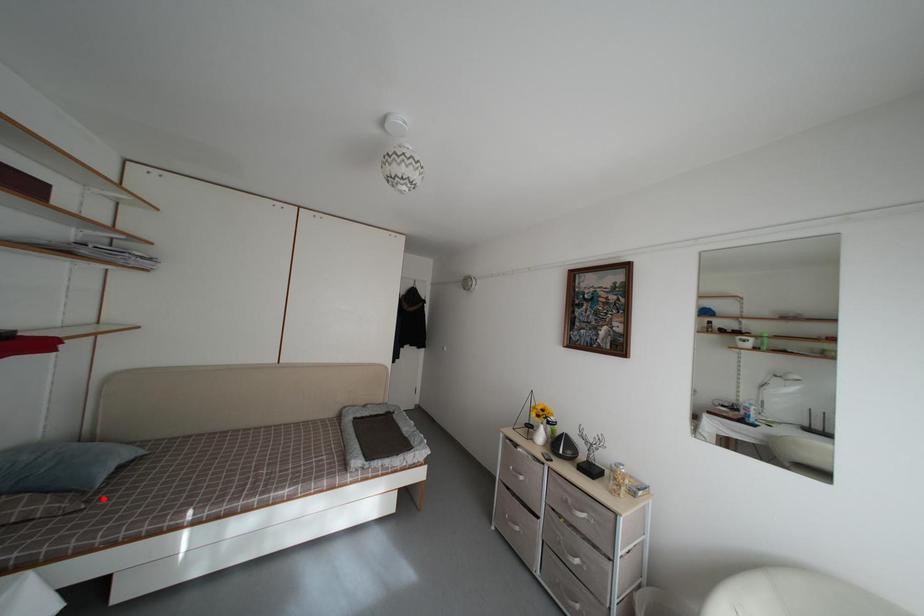
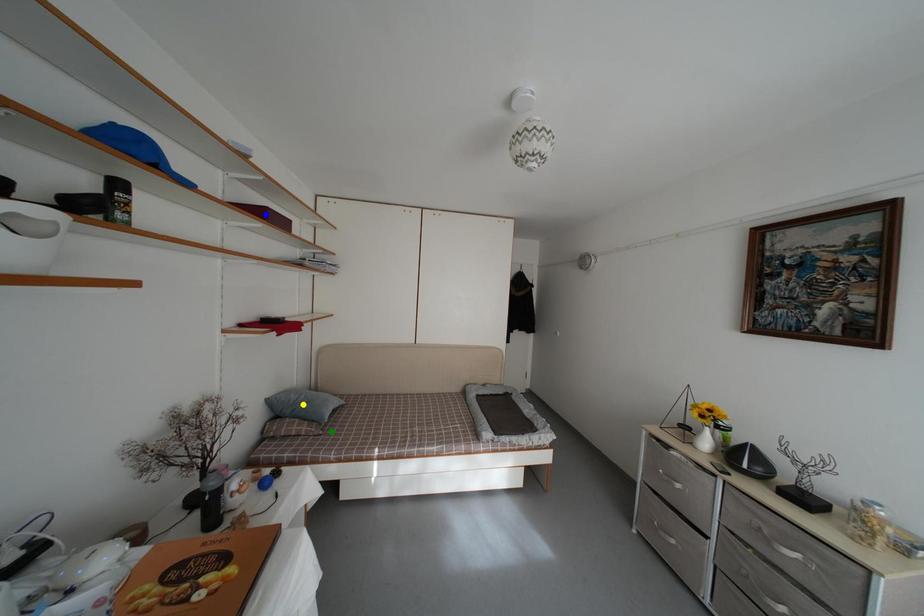
Question: I am providing you with two images of the same scene from different viewpoints. A red point is marked on the first image. You are given multiple points on the second image. In image 2, which mark is for the same physical point as the one in image 1?

Choices:
 (A) yellow point
 (B) blue point
 (C) green point

Answer: (C)